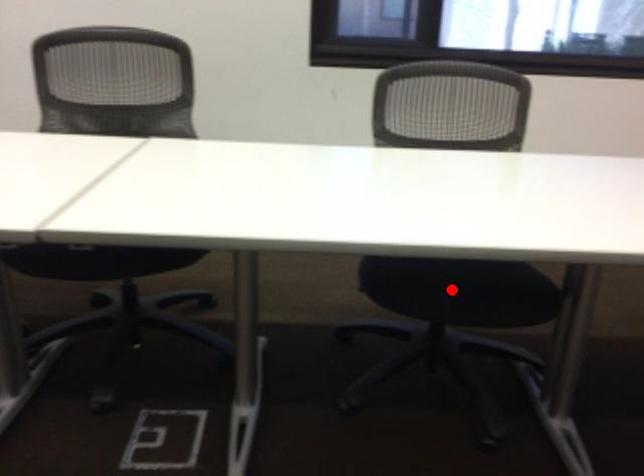
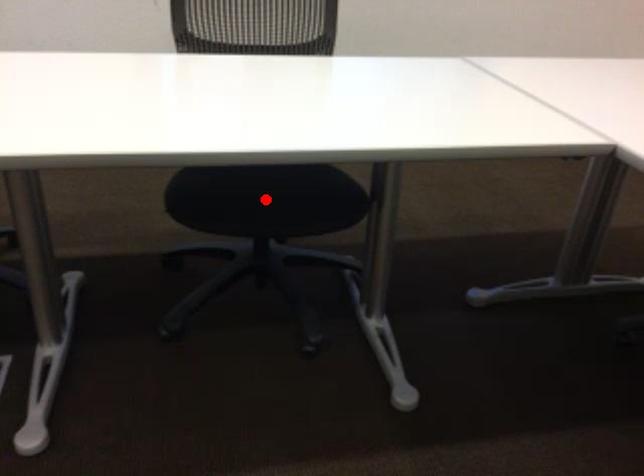
I am providing you with two images of the same scene from different viewpoints. A red point is marked on the first image and another point is marked on the second image. Is the red point in image1 aligned with the point shown in image2?

Yes